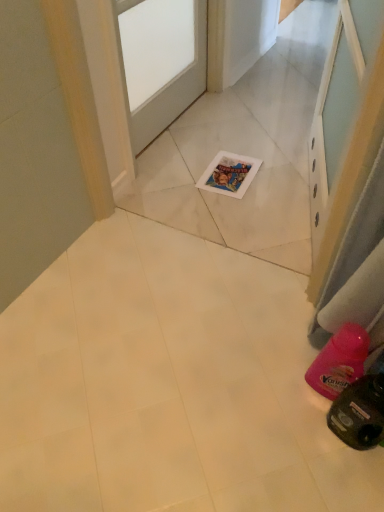
Question: Can you confirm if white matte door at center is wider than clear glass screen door at upper center?

Choices:
 (A) no
 (B) yes

Answer: (A)

Question: Can you confirm if white matte door at center is bigger than clear glass screen door at upper center?

Choices:
 (A) yes
 (B) no

Answer: (B)

Question: From a real-world perspective, is white matte door at center positioned under clear glass screen door at upper center based on gravity?

Choices:
 (A) yes
 (B) no

Answer: (A)

Question: From the image's perspective, does white matte door at center appear lower than clear glass screen door at upper center?

Choices:
 (A) yes
 (B) no

Answer: (B)

Question: Is white matte door at center outside clear glass screen door at upper center?

Choices:
 (A) no
 (B) yes

Answer: (B)

Question: Can you confirm if white matte door at center is smaller than clear glass screen door at upper center?

Choices:
 (A) yes
 (B) no

Answer: (A)

Question: Is clear glass screen door at upper center in contact with white matte door at center?

Choices:
 (A) yes
 (B) no

Answer: (B)

Question: Considering the relative sizes of clear glass screen door at upper center and white matte door at center in the image provided, is clear glass screen door at upper center taller than white matte door at center?

Choices:
 (A) no
 (B) yes

Answer: (B)

Question: Is clear glass screen door at upper center not near white matte door at center?

Choices:
 (A) yes
 (B) no

Answer: (B)

Question: From the image's perspective, is clear glass screen door at upper center on white matte door at center?

Choices:
 (A) yes
 (B) no

Answer: (B)

Question: Is clear glass screen door at upper center positioned with its back to white matte door at center?

Choices:
 (A) no
 (B) yes

Answer: (A)

Question: Is the position of clear glass screen door at upper center less distant than that of white matte door at center?

Choices:
 (A) no
 (B) yes

Answer: (B)

Question: Based on their positions, is white matte door at center located to the left or right of clear glass screen door at upper center?

Choices:
 (A) left
 (B) right

Answer: (A)